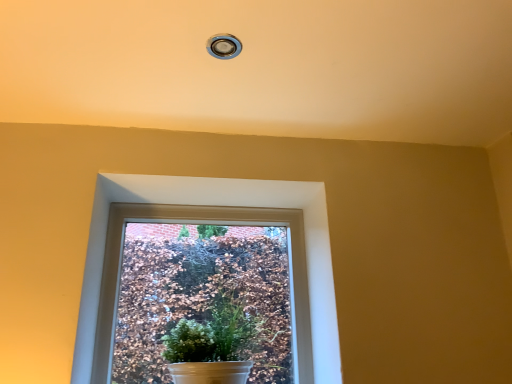
Question: Considering the relative positions of white matte pot at center and white glossy window at center in the image provided, is white matte pot at center to the left or to the right of white glossy window at center?

Choices:
 (A) right
 (B) left

Answer: (A)

Question: Looking at their shapes, would you say white matte pot at center is wider or thinner than white glossy window at center?

Choices:
 (A) thin
 (B) wide

Answer: (B)

Question: Considering the positions of white matte pot at center and white glossy window at center in the image, is white matte pot at center taller or shorter than white glossy window at center?

Choices:
 (A) short
 (B) tall

Answer: (A)

Question: Based on their positions, is white glossy window at center located to the left or right of white matte pot at center?

Choices:
 (A) left
 (B) right

Answer: (A)

Question: Based on their sizes in the image, would you say white glossy window at center is bigger or smaller than white matte pot at center?

Choices:
 (A) big
 (B) small

Answer: (B)

Question: From the image's perspective, is white glossy window at center above or below white matte pot at center?

Choices:
 (A) above
 (B) below

Answer: (A)

Question: Is white glossy window at center in front of or behind white matte pot at center in the image?

Choices:
 (A) behind
 (B) front

Answer: (A)